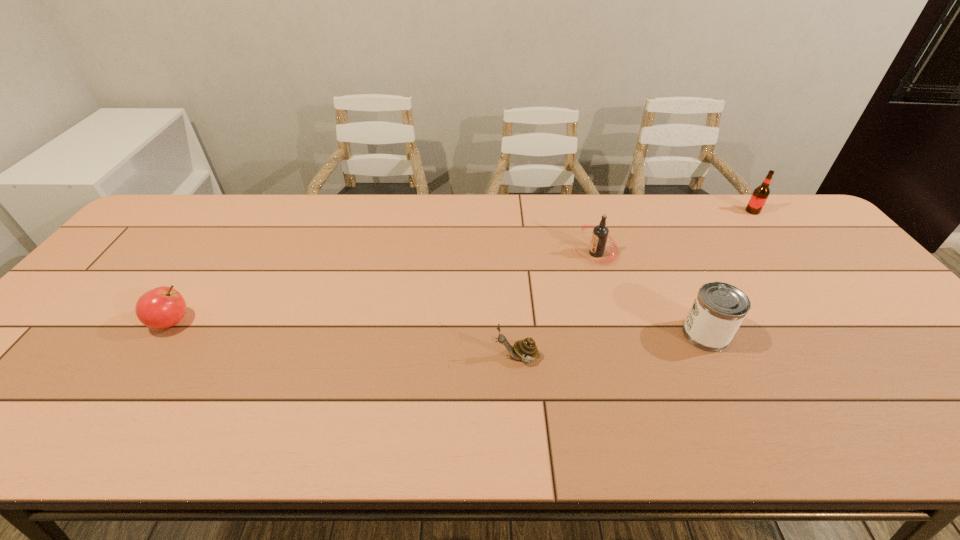
Where is `free space at the near edge`? The width and height of the screenshot is (960, 540). free space at the near edge is located at coordinates (182, 409).

The height and width of the screenshot is (540, 960). I want to click on vacant space at the left edge, so click(x=115, y=300).

Where is `vacant region at the right edge of the desktop`? The image size is (960, 540). vacant region at the right edge of the desktop is located at coordinates (856, 281).

Identify the location of free region at the far left corner of the desktop. The height and width of the screenshot is (540, 960). (184, 221).

Where is `vacant space that is in between the leftmost object and the snail`? vacant space that is in between the leftmost object and the snail is located at coordinates (345, 339).

This screenshot has width=960, height=540. What are the coordinates of `unoccupied position between the second object from right to left and the leftmost object` in the screenshot? It's located at 439,328.

Identify the location of unoccupied area between the nearer root beer and the can. (651, 294).

Where is `vacant point located between the snail and the right root beer`? The image size is (960, 540). vacant point located between the snail and the right root beer is located at coordinates (635, 284).

This screenshot has width=960, height=540. I want to click on vacant area that lies between the second object from right to left and the farther root beer, so click(x=729, y=273).

Image resolution: width=960 pixels, height=540 pixels. Identify the location of free spot between the farthest object and the can. (729, 273).